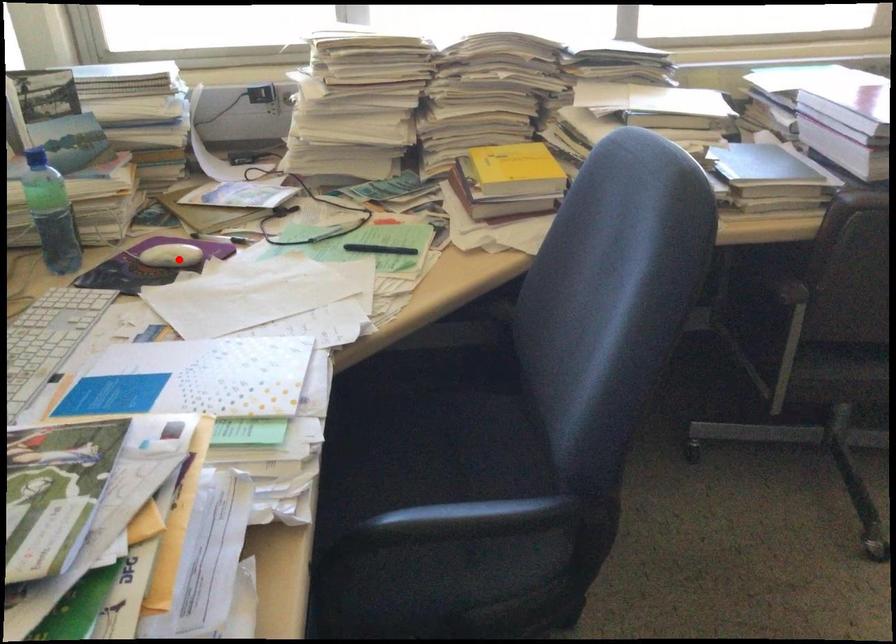
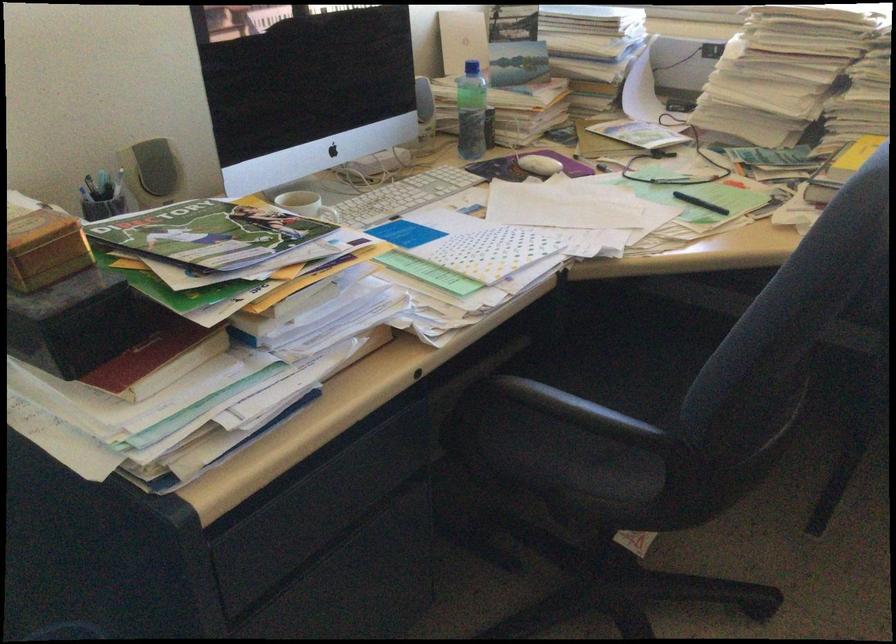
The point at the highlighted location is marked in the first image. Where is the corresponding point in the second image?

(538, 165)